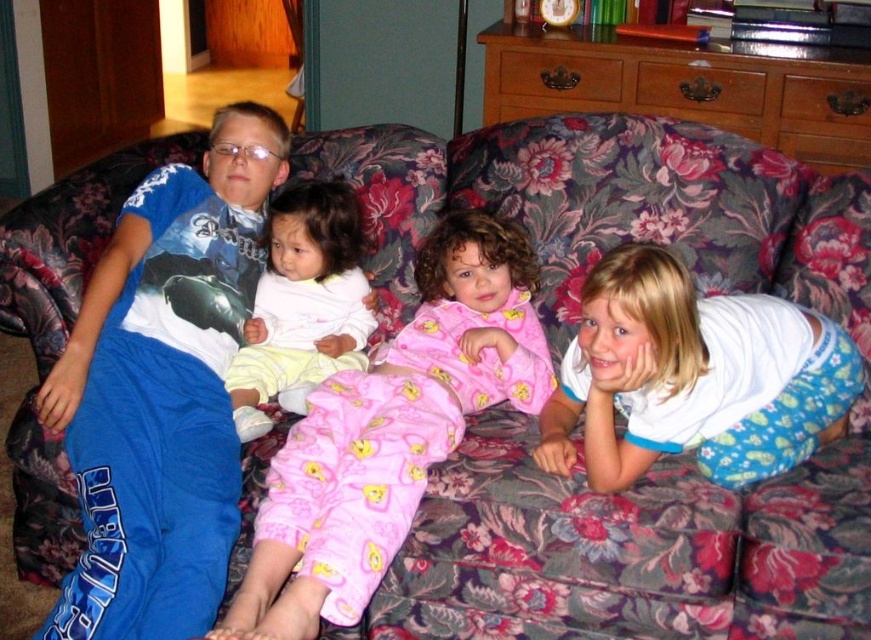
Question: Is pink cotton pajamas at center below white cotton shirt at right?

Choices:
 (A) yes
 (B) no

Answer: (A)

Question: Which of these objects is positioned closest to the white cotton shirt at right?

Choices:
 (A) white soft baby at center
 (B) pink cotton pajamas at center

Answer: (B)

Question: Which object is positioned farthest from the pink cotton pajamas at center?

Choices:
 (A) white cotton shirt at right
 (B) white soft baby at center

Answer: (A)

Question: Does white cotton shirt at right have a larger size compared to white soft baby at center?

Choices:
 (A) no
 (B) yes

Answer: (B)

Question: Does white cotton shirt at right appear over white soft baby at center?

Choices:
 (A) yes
 (B) no

Answer: (B)

Question: Estimate the real-world distances between objects in this image. Which object is farther from the white cotton shirt at right?

Choices:
 (A) pink cotton pajamas at center
 (B) white soft baby at center

Answer: (B)